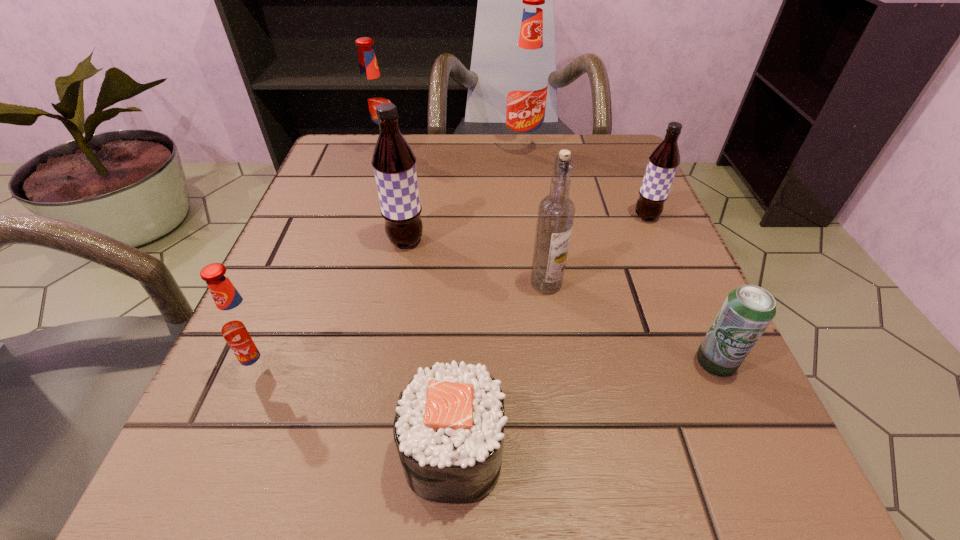
Image resolution: width=960 pixels, height=540 pixels. I want to click on the tallest root beer, so click(527, 86).

Find the location of a particular element. Image resolution: width=960 pixels, height=540 pixels. the tallest object is located at coordinates (527, 86).

The image size is (960, 540). I want to click on the fourth root beer from right to left, so click(x=372, y=93).

Image resolution: width=960 pixels, height=540 pixels. What are the coordinates of `the seventh object from right to left` in the screenshot? It's located at (372, 93).

Where is `the second nearest root beer`? the second nearest root beer is located at coordinates (394, 163).

At what (x,y) coordinates should I click in order to perform the action: click on the sixth object from right to left. Please return your answer as a coordinate pair (x, y). Looking at the image, I should click on (394, 163).

I want to click on vodka, so click(556, 212).

This screenshot has height=540, width=960. What are the coordinates of `the smaller brown root beer` in the screenshot? It's located at (663, 162).

At what (x,y) coordinates should I click in order to perform the action: click on the third nearest root beer. Please return your answer as a coordinate pair (x, y). The image size is (960, 540). Looking at the image, I should click on (663, 162).

The height and width of the screenshot is (540, 960). What are the coordinates of `the leftmost red root beer` in the screenshot? It's located at (245, 328).